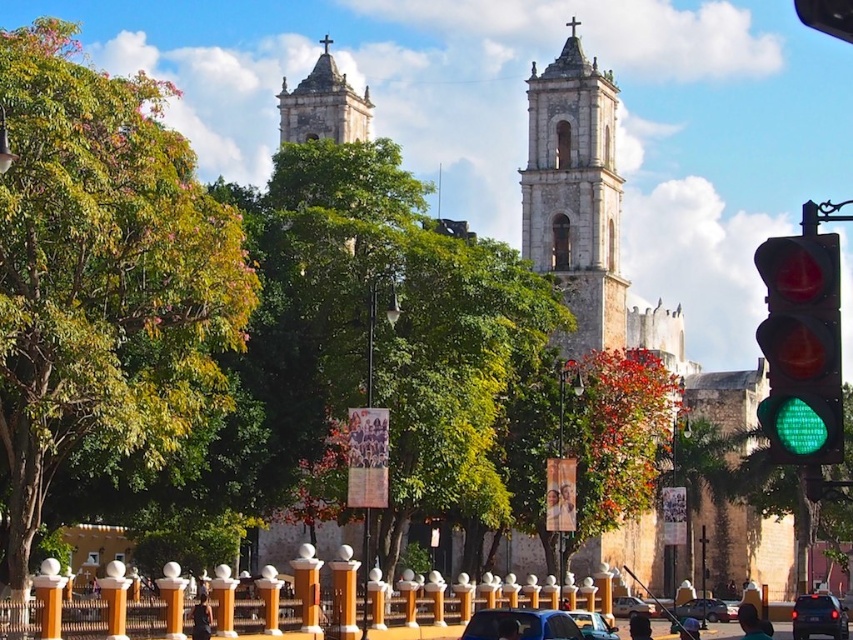
Between white stone tower at upper center and white plastic car at lower center, which one has more height?

white stone tower at upper center

Does point (317, 61) come closer to viewer compared to point (637, 600)?

That is False.

Does point (352, 99) come in front of point (642, 604)?

No.

Locate an element on the screen. Image resolution: width=853 pixels, height=640 pixels. white stone tower at upper center is located at coordinates (323, 106).

Can you confirm if white stone tower at upper center is positioned to the right of metallic blue car at center?

Incorrect, white stone tower at upper center is not on the right side of metallic blue car at center.

Is point (331, 97) positioned behind point (583, 620)?

Yes, point (331, 97) is behind point (583, 620).

You are a GUI agent. You are given a task and a screenshot of the screen. Output one action in this format:
    pyautogui.click(x=<x>, y=<y>)
    Task: Click on the white stone tower at upper center
    
    Given the screenshot: What is the action you would take?
    pyautogui.click(x=323, y=106)

Consider the image. Between white stone tower at upper center and shiny black sedan at lower right, which one appears on the left side from the viewer's perspective?

white stone tower at upper center is more to the left.

The width and height of the screenshot is (853, 640). Identify the location of white stone tower at upper center. (323, 106).

Where is `white stone tower at upper center`? white stone tower at upper center is located at coordinates point(323,106).